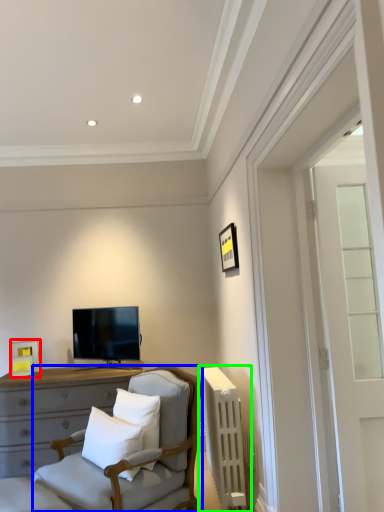
Question: Estimate the real-world distances between objects in this image. Which object is farther from picture frame (highlighted by a red box), chair (highlighted by a blue box) or radiator (highlighted by a green box)?

Choices:
 (A) chair
 (B) radiator

Answer: (B)